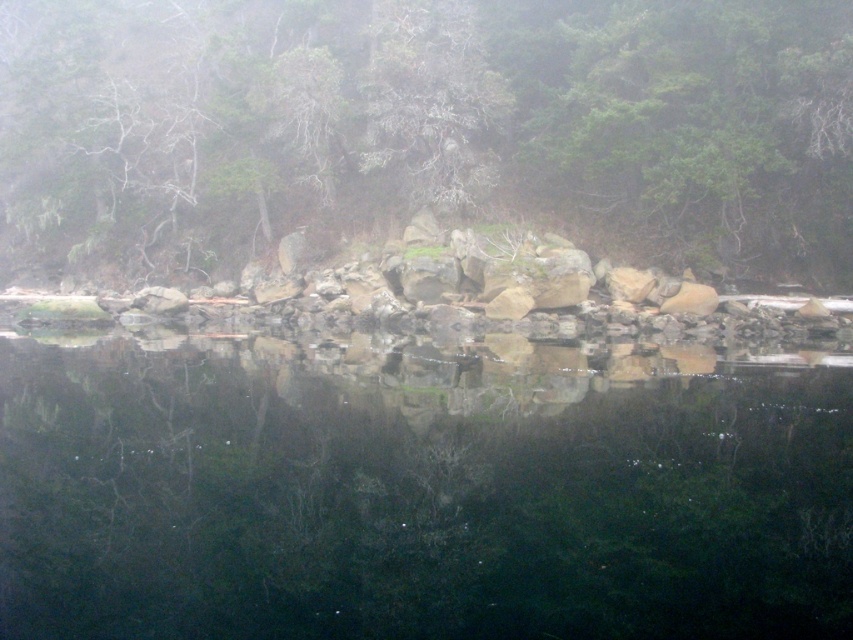
Can you confirm if transparent water at center is positioned to the left of green matte tree at center?

Incorrect, transparent water at center is not on the left side of green matte tree at center.

Can you confirm if transparent water at center is positioned below green matte tree at center?

Indeed, transparent water at center is positioned under green matte tree at center.

Identify the location of transparent water at center. [x=421, y=490].